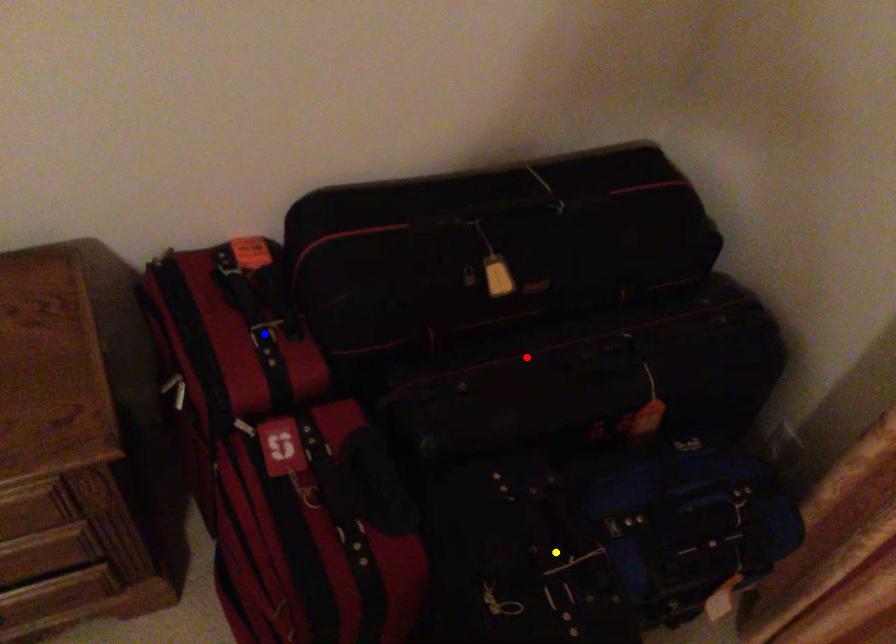
Order these from farthest to nearest:
yellow point | blue point | red point

red point → blue point → yellow point